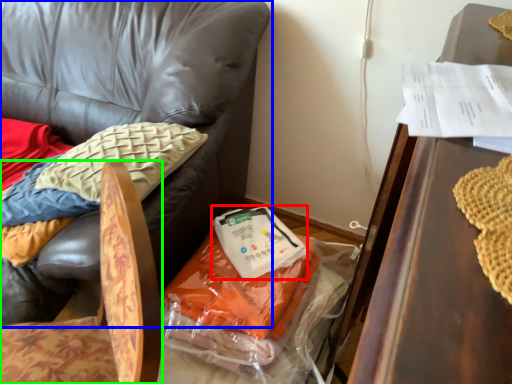
Question: Which object is positioned closest to food (highlighted by a red box)? Select from chair (highlighted by a blue box) and chair (highlighted by a green box).

Choices:
 (A) chair
 (B) chair

Answer: (A)